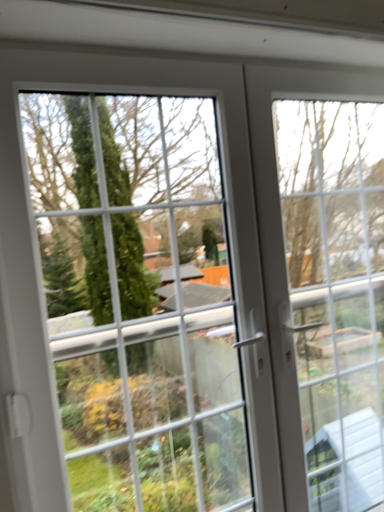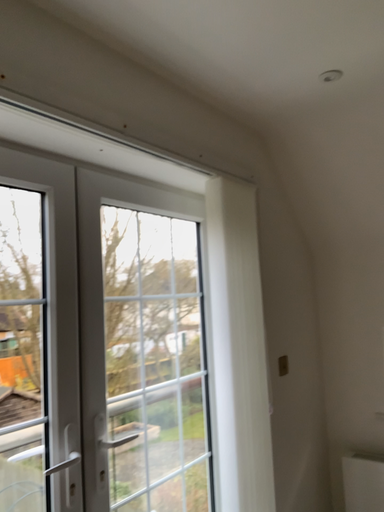
Question: Which way did the camera rotate in the video?

Choices:
 (A) rotated right
 (B) rotated left

Answer: (A)